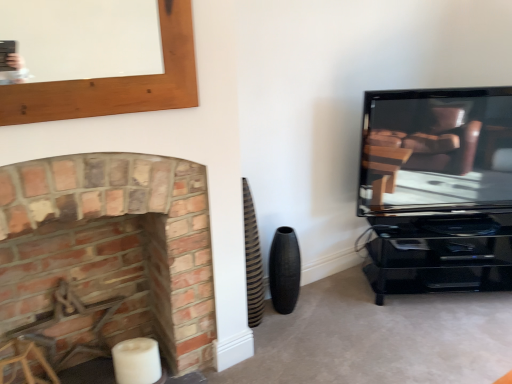
Question: Is brick fireplace at left inside or outside of matte black tv at right?

Choices:
 (A) outside
 (B) inside

Answer: (A)

Question: Is point (52, 314) closer or farther from the camera than point (369, 130)?

Choices:
 (A) closer
 (B) farther

Answer: (A)

Question: Considering the real-world distances, which object is closest to the metallic brown swivel chair at left?

Choices:
 (A) matte black tv at right
 (B) black textured vase at lower center
 (C) brick fireplace at left

Answer: (C)

Question: Which object is the closest to the black textured vase at lower center?

Choices:
 (A) brick fireplace at left
 (B) matte black tv at right
 (C) metallic brown swivel chair at left

Answer: (A)